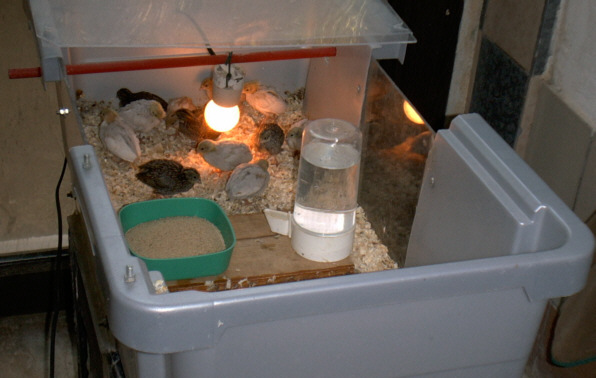
Find the location of a particular element. This screenshot has height=378, width=596. green bowl is located at coordinates (220, 256).